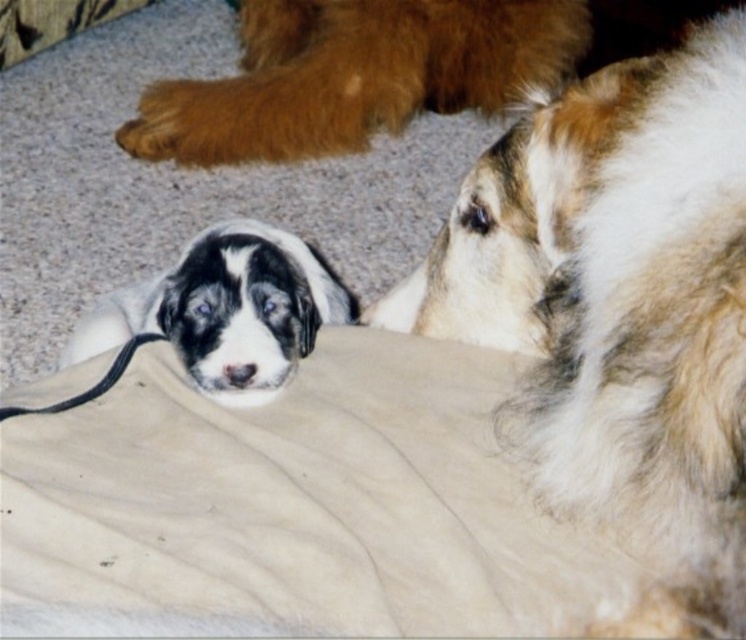
Who is positioned more to the right, beige fabric at center or brown fluffy paw at upper center?

From the viewer's perspective, brown fluffy paw at upper center appears more on the right side.

Is beige fabric at center smaller than brown fluffy paw at upper center?

Yes, beige fabric at center is smaller than brown fluffy paw at upper center.

The image size is (746, 640). I want to click on beige fabric at center, so click(300, 500).

Is brown fluffy paw at upper center to the left of black rubber leash at lower left from the viewer's perspective?

No, brown fluffy paw at upper center is not to the left of black rubber leash at lower left.

Which is above, brown fluffy paw at upper center or black rubber leash at lower left?

brown fluffy paw at upper center is higher up.

Does point (263, 141) lie behind point (72, 403)?

Yes, it is.

Locate an element on the screen. This screenshot has width=746, height=640. brown fluffy paw at upper center is located at coordinates (354, 74).

Does beige fabric at center lie behind black rubber leash at lower left?

That is False.

At what (x,y) coordinates should I click in order to perform the action: click on beige fabric at center. Please return your answer as a coordinate pair (x, y). The height and width of the screenshot is (640, 746). Looking at the image, I should click on (300, 500).

Who is more distant from viewer, (310,426) or (1,406)?

The point (310,426) is behind.

I want to click on beige fabric at center, so click(x=300, y=500).